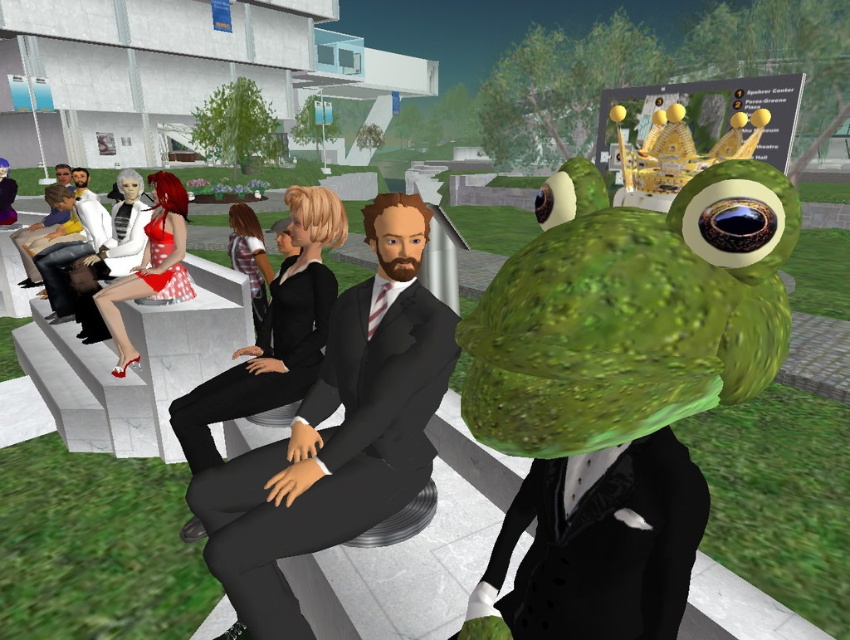
Question: Does black suit at center come behind matte red dress at left?

Choices:
 (A) yes
 (B) no

Answer: (B)

Question: Among these objects, which one is farthest from the camera?

Choices:
 (A) black suit at center
 (B) green matte/fuzzy frog at center

Answer: (A)

Question: Which point appears closest to the camera in this image?

Choices:
 (A) (332, 483)
 (B) (321, 289)

Answer: (A)

Question: From the image, what is the correct spatial relationship of black suit at center in relation to matte red dress at left?

Choices:
 (A) below
 (B) above

Answer: (A)

Question: Which point is farther to the camera?

Choices:
 (A) black suit at center
 (B) matte red dress at left

Answer: (B)

Question: Is black suit at center further to the viewer compared to black matte suit at center?

Choices:
 (A) no
 (B) yes

Answer: (A)